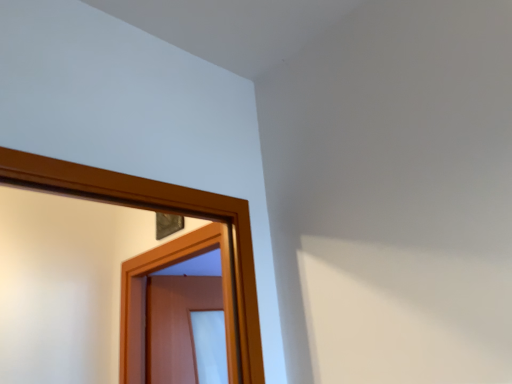
This screenshot has height=384, width=512. What do you see at coordinates (180, 327) in the screenshot? I see `brown wooden screen door at center` at bounding box center [180, 327].

Where is `brown wooden screen door at center`? This screenshot has width=512, height=384. brown wooden screen door at center is located at coordinates (180, 327).

Image resolution: width=512 pixels, height=384 pixels. Identify the location of brown wooden screen door at center. (180, 327).